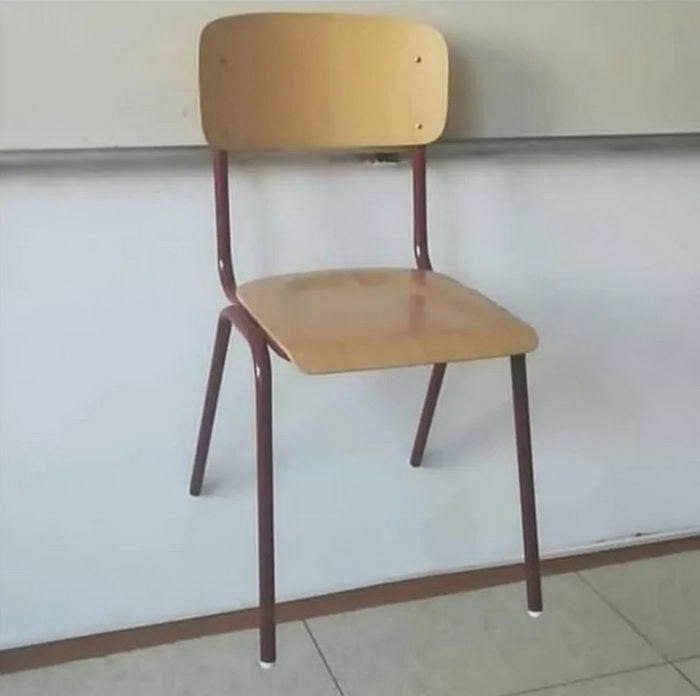
At what (x,y) coordinates should I click in order to perform the action: click on dark wooden legs. Please return your answer as a coordinate pair (x, y). The image size is (700, 696). Looking at the image, I should click on (214, 381), (262, 381), (432, 395), (516, 395), (421, 221), (224, 198).